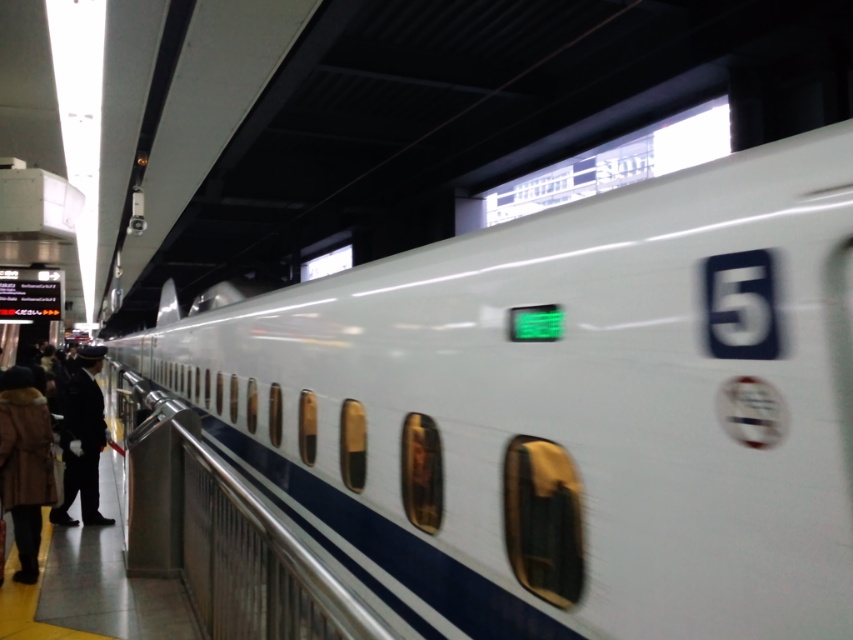
You are a passenger waiting to board the white glossy train at center. You notice a brown fuzzy coat at lower left lying on the platform. If you want to pick up the coat before boarding, will you be able to reach it from your current position?

The white glossy train at center and brown fuzzy coat at lower left are 3.07 meters apart. Since the distance is more than an average person can reach, you cannot pick up the coat without moving closer.

You are standing on the platform and want to know where the point at coordinates (24, 464) is located. According to the scene description, which object is this point part of?

The point at coordinates (24, 464) is part of the brown fuzzy coat at lower left.

You are a passenger waiting at the station platform. You notice the white glossy train at center and the dark blue uniform at left. Which object is positioned higher from the ground?

The white glossy train at center is positioned higher from the ground than the dark blue uniform at left because it is above it.